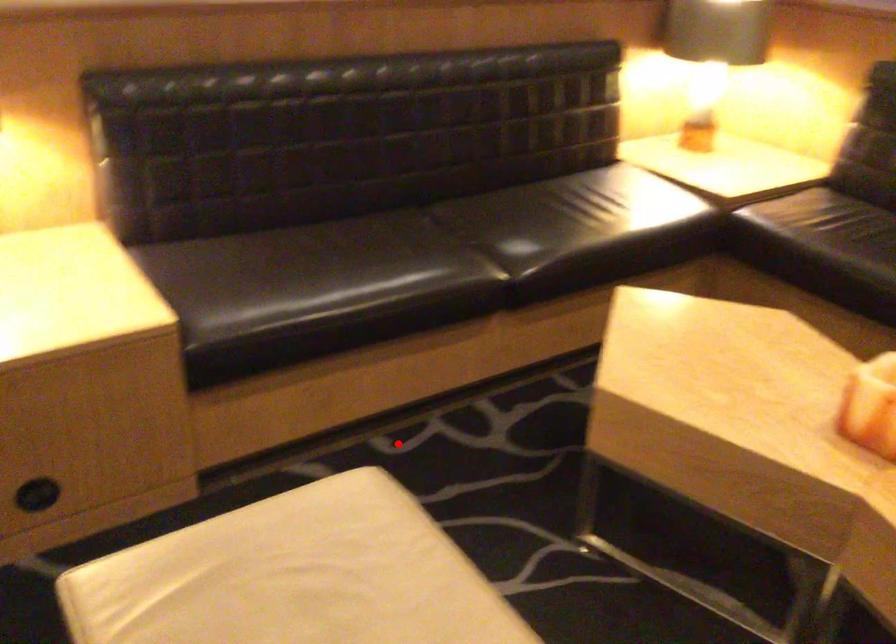
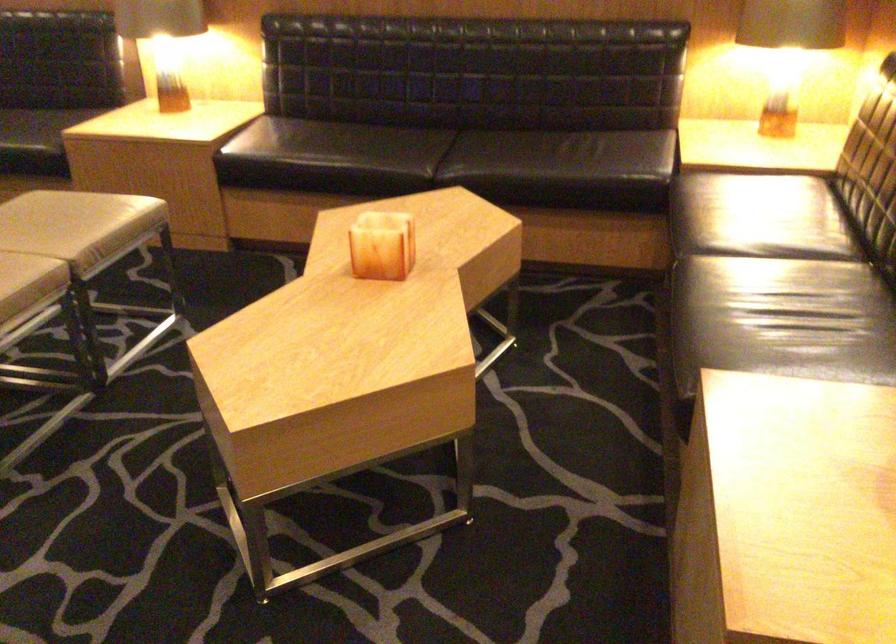
Where in the second image is the point corresponding to the highlighted location from the first image?

(283, 263)